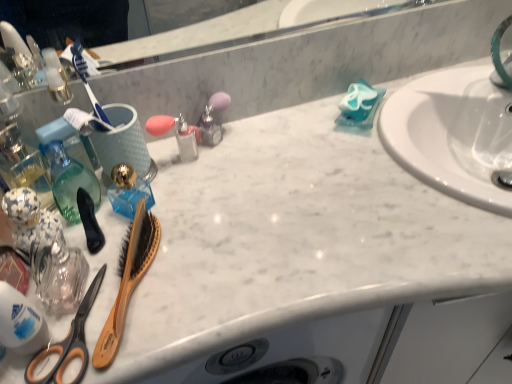
Locate an element on the screen. empty space that is in between translucent purple bottle at center and wooden bristle brush at left, which ranks as the 2th brush in left-to-right order is located at coordinates (183, 206).